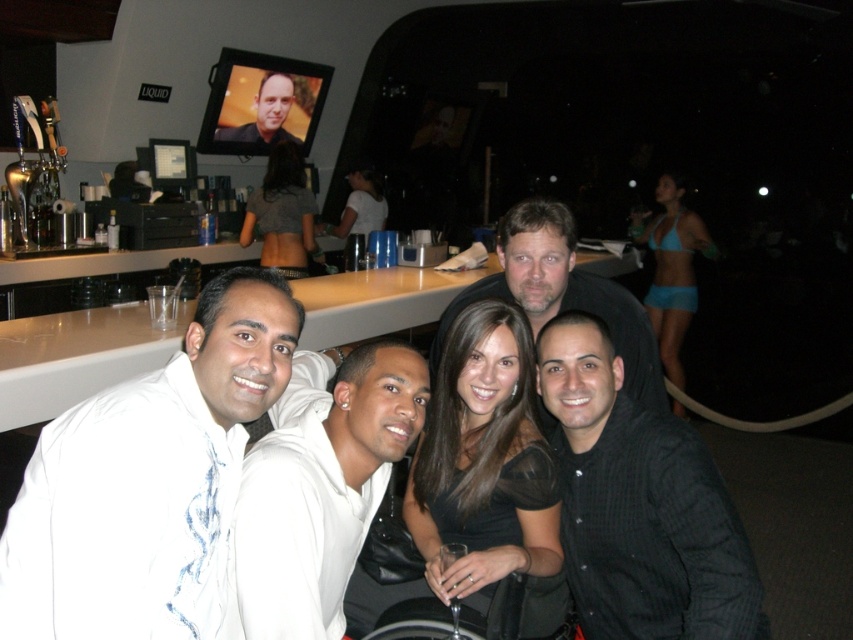
Question: Is gray fabric top at upper center thinner than matte black shirt at center?

Choices:
 (A) no
 (B) yes

Answer: (A)

Question: Among these points, which one is farthest from the camera?

Choices:
 (A) (274, 241)
 (B) (361, 163)

Answer: (B)

Question: Is black matte dress at center to the left of black matte shirt at center from the viewer's perspective?

Choices:
 (A) yes
 (B) no

Answer: (A)

Question: Which object is closer to the camera taking this photo?

Choices:
 (A) black pinstripe shirt at center
 (B) white matte hoodie at center

Answer: (B)

Question: Which point appears closest to the camera in this image?

Choices:
 (A) (665, 195)
 (B) (277, 588)
 (C) (664, 564)
 (D) (612, 289)

Answer: (B)

Question: Can you confirm if black matte shirt at center is positioned to the left of matte black dress at center?

Choices:
 (A) yes
 (B) no

Answer: (B)